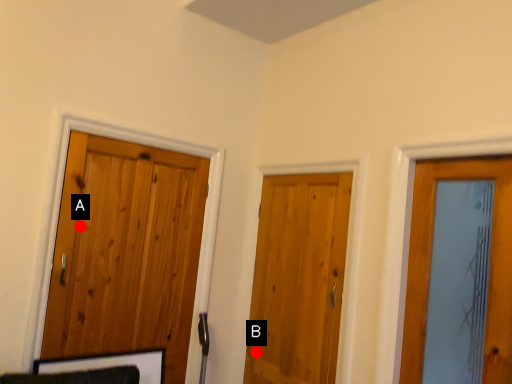
Question: Two points are circled on the image, labeled by A and B beside each circle. Which point is closer to the camera taking this photo?

Choices:
 (A) A is closer
 (B) B is closer

Answer: (A)